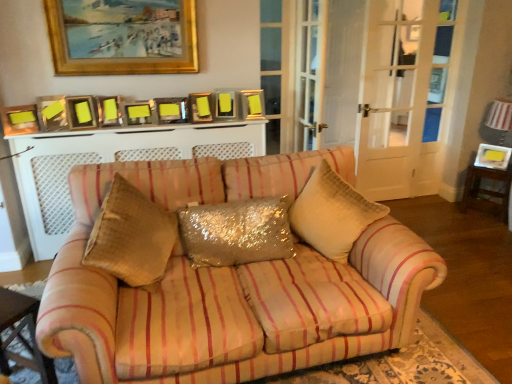
The width and height of the screenshot is (512, 384). Identify the location of wooden picture frame at upper center, the 9th picture frame positioned from the right. (80, 112).

Identify the location of white textured fireplace at center. Image resolution: width=512 pixels, height=384 pixels. (111, 161).

You are a GUI agent. You are given a task and a screenshot of the screen. Output one action in this format:
    pyautogui.click(x=<x>, y=<y>)
    Task: Click on the wooden picture frame at upper center, the third picture frame positioned from the left
    
    Given the screenshot: What is the action you would take?
    pyautogui.click(x=80, y=112)

Is matte gold picture frame at left, which is counted as the first picture frame, starting from the left, facing away from matte gold picture frame at center, the 7th picture frame in the bottom-to-top sequence?

matte gold picture frame at left, which is counted as the first picture frame, starting from the left, does not have its back to matte gold picture frame at center, the 7th picture frame in the bottom-to-top sequence.

Visually, is matte gold picture frame at left, which is counted as the first picture frame, starting from the left, positioned to the left or to the right of matte gold picture frame at center, which is counted as the eighth picture frame, starting from the front?

Clearly, matte gold picture frame at left, which is counted as the first picture frame, starting from the left, is on the left of matte gold picture frame at center, which is counted as the eighth picture frame, starting from the front, in the image.

Considering the points (9, 131) and (159, 119), which point is in front, point (9, 131) or point (159, 119)?

The point (9, 131) is closer.

Is matte gold picture frame at left, the 2th picture frame viewed from the front, far from matte gold picture frame at center, marked as the fourth picture frame in a back-to-front arrangement?

No, matte gold picture frame at left, the 2th picture frame viewed from the front, is not far from matte gold picture frame at center, marked as the fourth picture frame in a back-to-front arrangement.

Which of these two, metallic silver picture frame at upper right, acting as the 1th picture frame starting from the right, or metallic gold picture frame at center, the sixth picture frame from the front, is wider?

Wider between the two is metallic silver picture frame at upper right, acting as the 1th picture frame starting from the right.

Is metallic silver picture frame at upper right, the eleventh picture frame in the left-to-right sequence, touching metallic gold picture frame at center, the sixth picture frame from the front?

metallic silver picture frame at upper right, the eleventh picture frame in the left-to-right sequence, and metallic gold picture frame at center, the sixth picture frame from the front, are not in contact.

Would you say metallic silver picture frame at upper right, acting as the 1th picture frame starting from the right, contains metallic gold picture frame at center, the 6th picture frame viewed from the right?

No, metallic silver picture frame at upper right, acting as the 1th picture frame starting from the right, does not contain metallic gold picture frame at center, the 6th picture frame viewed from the right.

Is white textured fireplace at center oriented away from wooden table at right, acting as the second table starting from the left?

That's not correct — white textured fireplace at center is not looking away from wooden table at right, acting as the second table starting from the left.

Would you consider white textured fireplace at center to be distant from wooden table at right, acting as the second table starting from the left?

Indeed, white textured fireplace at center is not near wooden table at right, acting as the second table starting from the left.

Which object is further away from the camera, white textured fireplace at center or wooden table at right, positioned as the second table in bottom-to-top order?

wooden table at right, positioned as the second table in bottom-to-top order, is further from the camera.

From the picture: Is white textured fireplace at center wider than wooden table at right, placed as the 1th table when sorted from right to left?

No, white textured fireplace at center is not wider than wooden table at right, placed as the 1th table when sorted from right to left.

From the image's perspective, is metallic silver picture frame at upper right, which ranks as the 11th picture frame in bottom-to-top order, over metallic gold picture frame at right, which ranks as the second picture frame in right-to-left order?

Yes.

Is metallic silver picture frame at upper right, acting as the 1th picture frame starting from the right, far from metallic gold picture frame at right, the 10th picture frame positioned from the front?

Yes, metallic silver picture frame at upper right, acting as the 1th picture frame starting from the right, and metallic gold picture frame at right, the 10th picture frame positioned from the front, are located far from each other.

From a real-world perspective, which is physically above, metallic silver picture frame at upper right, marked as the first picture frame in a top-to-bottom arrangement, or metallic gold picture frame at right, which is the 1th picture frame from bottom to top?

In real-world perspective, metallic silver picture frame at upper right, marked as the first picture frame in a top-to-bottom arrangement, is above.

Is striped fabric couch at center wider than wooden table at lower left, the 1th table when ordered from front to back?

Indeed, striped fabric couch at center has a greater width compared to wooden table at lower left, the 1th table when ordered from front to back.

From a real-world perspective, who is located higher, striped fabric couch at center or wooden table at lower left, the 2th table when ordered from back to front?

From a 3D spatial view, wooden table at lower left, the 2th table when ordered from back to front, is above.

Is striped fabric couch at center positioned behind wooden table at lower left, the 2th table when ordered from back to front?

No, it is not.

Could you tell me if gold-framed painting at upper center, the second picture frame when ordered from top to bottom, is facing wooden picture frame at upper center, the third picture frame positioned from the left?

No, gold-framed painting at upper center, the second picture frame when ordered from top to bottom, does not turn towards wooden picture frame at upper center, the third picture frame positioned from the left.

Is gold-framed painting at upper center, which is counted as the 11th picture frame, starting from the back, not near wooden picture frame at upper center, the 9th picture frame positioned from the right?

No, gold-framed painting at upper center, which is counted as the 11th picture frame, starting from the back, is not far away from wooden picture frame at upper center, the 9th picture frame positioned from the right.

Can you confirm if gold-framed painting at upper center, placed as the fifth picture frame when sorted from left to right, is shorter than wooden picture frame at upper center, marked as the 5th picture frame in a bottom-to-top arrangement?

Incorrect, the height of gold-framed painting at upper center, placed as the fifth picture frame when sorted from left to right, does not fall short of that of wooden picture frame at upper center, marked as the 5th picture frame in a bottom-to-top arrangement.

Considering the positions of objects gold-framed painting at upper center, placed as the fifth picture frame when sorted from left to right, and wooden picture frame at upper center, the 9th picture frame positioned from the right, in the image provided, who is more to the left, gold-framed painting at upper center, placed as the fifth picture frame when sorted from left to right, or wooden picture frame at upper center, the 9th picture frame positioned from the right,?

From the viewer's perspective, wooden picture frame at upper center, the 9th picture frame positioned from the right, appears more on the left side.

From the metallic gold picture frame at upper center, placed as the eighth picture frame when sorted from right to left, count 3rd picture frames forward and point to it. Please provide its 2D coordinates.

[(19, 120)]

From the picture: Could you tell me if metallic gold picture frame at upper center, placed as the eighth picture frame when sorted from right to left, is turned towards matte gold picture frame at left, the 2th picture frame viewed from the front?

No.

Relative to matte gold picture frame at left, the 2th picture frame viewed from the front, is metallic gold picture frame at upper center, which is the seventh picture frame in back-to-front order, in front or behind?

metallic gold picture frame at upper center, which is the seventh picture frame in back-to-front order, is behind matte gold picture frame at left, the 2th picture frame viewed from the front.

Between metallic gold picture frame at upper center, arranged as the sixth picture frame when viewed from the top, and matte gold picture frame at left, the 2th picture frame viewed from the front, which one appears on the left side from the viewer's perspective?

matte gold picture frame at left, the 2th picture frame viewed from the front, is more to the left.

From the matte gold picture frame at left, placed as the eleventh picture frame when sorted from right to left, count 6th picture frames backward and point to it. Please provide its 2D coordinates.

[(170, 110)]

Where is `the 5th picture frame counting from the left side of the metallic silver picture frame at upper right, which is counted as the 11th picture frame, starting from the front`? Image resolution: width=512 pixels, height=384 pixels. the 5th picture frame counting from the left side of the metallic silver picture frame at upper right, which is counted as the 11th picture frame, starting from the front is located at coordinates (139, 113).

Which object lies nearer to the anchor point matte silver picture frame at upper left, the 9th picture frame positioned from the top, shiny gold pillow at center or metallic gold picture frame at center, marked as the 8th picture frame in a top-to-bottom arrangement?

Based on the image, metallic gold picture frame at center, marked as the 8th picture frame in a top-to-bottom arrangement, appears to be nearer to matte silver picture frame at upper left, the 9th picture frame positioned from the top.

Looking at the image, which one is located closer to gold-framed painting at upper center, placed as the fifth picture frame when sorted from left to right, white textured fireplace at center or matte gold picture frame at left, the 2th picture frame viewed from the front?

white textured fireplace at center lies closer to gold-framed painting at upper center, placed as the fifth picture frame when sorted from left to right, than the other object.

Based on their spatial positions, is wooden table at lower left, which appears as the first table when viewed from the left, or matte silver picture frame at upper left, the 9th picture frame in the back-to-front sequence, closer to gold-framed painting at upper center, marked as the tenth picture frame in a bottom-to-top arrangement?

Based on the image, matte silver picture frame at upper left, the 9th picture frame in the back-to-front sequence, appears to be nearer to gold-framed painting at upper center, marked as the tenth picture frame in a bottom-to-top arrangement.

Considering their positions, is matte silver picture frame at upper left, marked as the 10th picture frame in a right-to-left arrangement, positioned further to gold-framed painting at upper center, the second picture frame when ordered from top to bottom, than matte gold picture frame at upper center, the 9th picture frame in the left-to-right sequence?

matte gold picture frame at upper center, the 9th picture frame in the left-to-right sequence.

From the image, which object appears to be farther from metallic gold picture frame at upper center, arranged as the sixth picture frame when viewed from the top, shiny gold pillow at center or gold-framed painting at upper center, marked as the tenth picture frame in a bottom-to-top arrangement?

Among the two, shiny gold pillow at center is located further to metallic gold picture frame at upper center, arranged as the sixth picture frame when viewed from the top.

Based on their spatial positions, is glittery sequined pillow at center or metallic silver picture frame at upper right, which ranks as the 11th picture frame in bottom-to-top order, closer to metallic silver picture frame at center, placed as the 7th picture frame when sorted from front to back?

Based on the image, glittery sequined pillow at center appears to be nearer to metallic silver picture frame at center, placed as the 7th picture frame when sorted from front to back.

From the picture: Which object lies nearer to the anchor point metallic silver picture frame at center, which appears as the eighth picture frame when ordered from the bottom, matte gold picture frame at left, arranged as the 10th picture frame when viewed from the top, or gold-framed painting at upper center, acting as the seventh picture frame starting from the right?

gold-framed painting at upper center, acting as the seventh picture frame starting from the right, is closer to metallic silver picture frame at center, which appears as the eighth picture frame when ordered from the bottom.

Considering their positions, is metallic gold picture frame at center, the 6th picture frame viewed from the right, positioned closer to matte silver picture frame at upper left, the 3th picture frame positioned from the front, than gold-framed painting at upper center, positioned as the 1th picture frame in front-to-back order?

Among the two, metallic gold picture frame at center, the 6th picture frame viewed from the right, is located nearer to matte silver picture frame at upper left, the 3th picture frame positioned from the front.

Image resolution: width=512 pixels, height=384 pixels. What are the coordinates of `pillow that lies between gold-framed painting at upper center, marked as the tenth picture frame in a bottom-to-top arrangement, and striped fabric couch at center from top to bottom` in the screenshot? It's located at (237, 232).

Where is `table between matte silver picture frame at upper left, marked as the 10th picture frame in a right-to-left arrangement, and wooden table at right, acting as the second table starting from the left, in the horizontal direction`? The width and height of the screenshot is (512, 384). table between matte silver picture frame at upper left, marked as the 10th picture frame in a right-to-left arrangement, and wooden table at right, acting as the second table starting from the left, in the horizontal direction is located at coordinates (20, 334).

Where is `pillow between matte silver picture frame at upper left, the 9th picture frame in the back-to-front sequence, and striped fabric couch at center, in the horizontal direction`? pillow between matte silver picture frame at upper left, the 9th picture frame in the back-to-front sequence, and striped fabric couch at center, in the horizontal direction is located at coordinates (237, 232).

You are a GUI agent. You are given a task and a screenshot of the screen. Output one action in this format:
    pyautogui.click(x=<x>, y=<y>)
    Task: Click on the throw pillow between metallic gold picture frame at center, marked as the fourth picture frame in a bottom-to-top arrangement, and striped fabric couch at center from left to right
    The height and width of the screenshot is (384, 512).
    Given the screenshot: What is the action you would take?
    pyautogui.click(x=332, y=213)